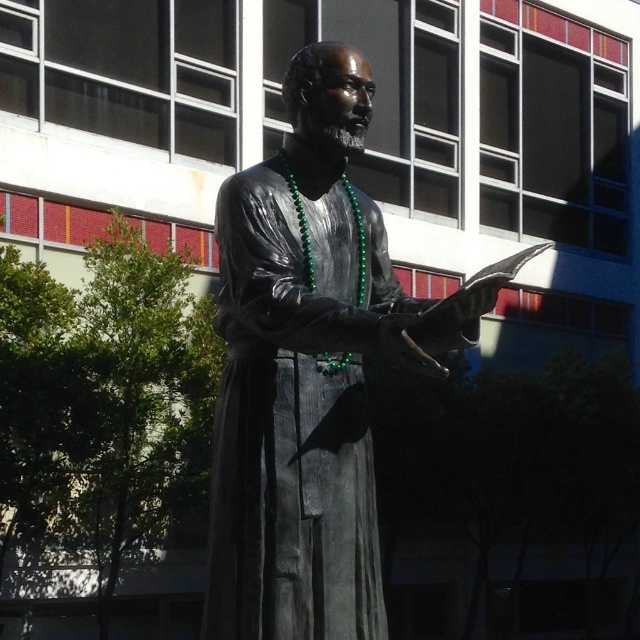
Is bronze statue at center bigger than bronze textured robe at center?

Yes.

I want to click on bronze statue at center, so click(x=310, y=369).